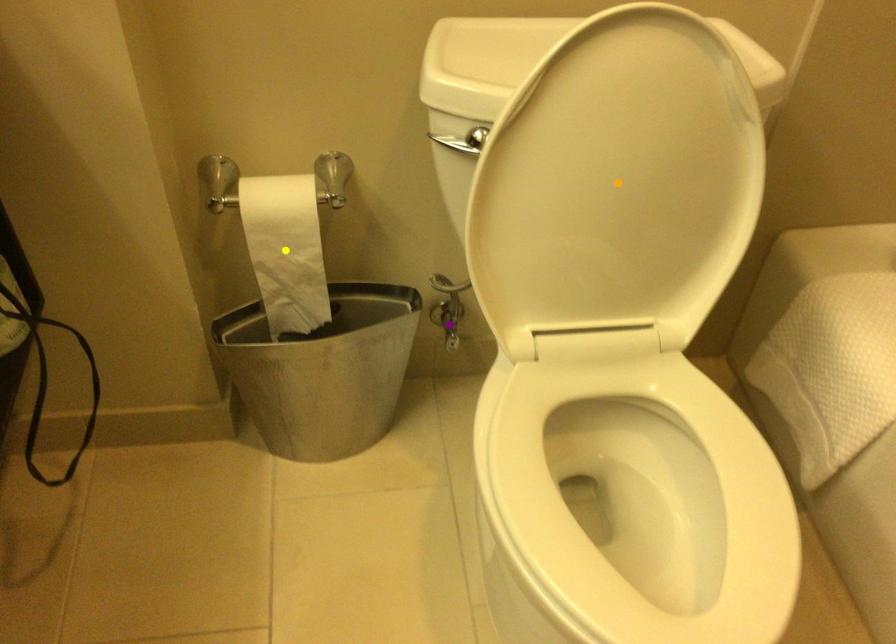
Order these from nearest to farthest:
purple point, orange point, yellow point

purple point, yellow point, orange point